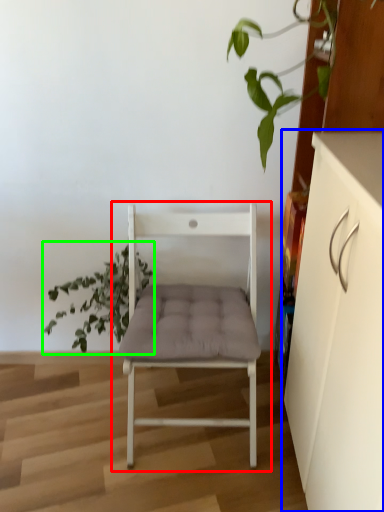
Question: Estimate the real-world distances between objects in this image. Which object is farther from chair (highlighted by a red box), cabinetry (highlighted by a blue box) or houseplant (highlighted by a green box)?

Choices:
 (A) cabinetry
 (B) houseplant

Answer: (A)